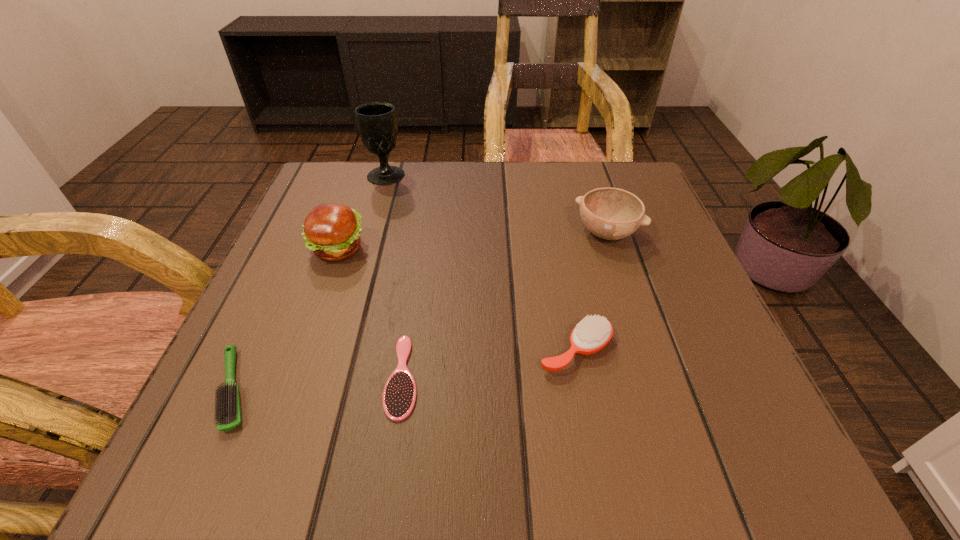
Identify the location of vacant space located 0.090m on the right of the farthest object. (443, 175).

Find the location of a particular element. vacant space situated on the back of the fifth shortest object is located at coordinates (363, 177).

Identify the location of free space located 0.050m on the front of the bowl. The width and height of the screenshot is (960, 540). pos(619,271).

What are the coordinates of `free space located 0.300m on the back of the tallest hairbrush` in the screenshot? It's located at (550, 216).

Locate an element on the screen. free point located on the back of the leftmost hairbrush is located at coordinates (286, 274).

At what (x,y) coordinates should I click in order to perform the action: click on free space located 0.220m on the right of the shortest hairbrush. Please return your answer as a coordinate pair (x, y). The image size is (960, 540). Looking at the image, I should click on (568, 376).

Locate an element on the screen. The height and width of the screenshot is (540, 960). chalice that is at the far edge is located at coordinates click(376, 121).

Identify the location of bowl located at the far edge. Image resolution: width=960 pixels, height=540 pixels. (610, 213).

Identify the location of chalice located in the left edge section of the desktop. The height and width of the screenshot is (540, 960). (376, 121).

The width and height of the screenshot is (960, 540). I want to click on hamburger that is at the left edge, so click(x=332, y=231).